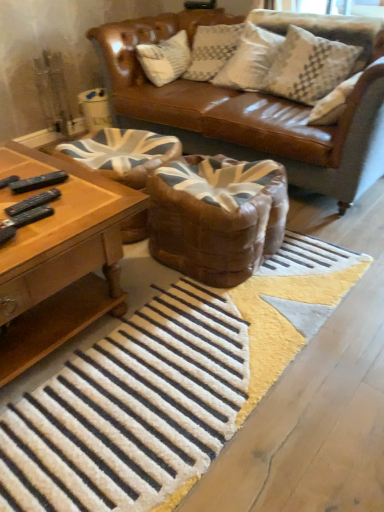
What is the approximate width of brown leather swivel chair at center, which ranks as the 1th swivel chair in right-to-left order?

brown leather swivel chair at center, which ranks as the 1th swivel chair in right-to-left order, is 20.71 inches wide.

Describe the element at coordinates (166, 387) in the screenshot. The image size is (384, 512). I see `white textured rug at center` at that location.

Identify the location of brown woven swivel chair at center, which is the first swivel chair from left to right. (122, 153).

Describe the element at coordinates (122, 153) in the screenshot. I see `brown woven swivel chair at center, which is the first swivel chair from left to right` at that location.

What do you see at coordinates (309, 66) in the screenshot? I see `white textured pillow at upper right` at bounding box center [309, 66].

What are the coordinates of `woodenobject at left` in the screenshot? It's located at (60, 261).

Could you tell me if white textured rug at center is turned towards brown woven swivel chair at center, which is the first swivel chair from left to right?

No, white textured rug at center is not oriented towards brown woven swivel chair at center, which is the first swivel chair from left to right.

Is brown woven swivel chair at center, positioned as the second swivel chair in right-to-left order, a part of white textured rug at center?

No, brown woven swivel chair at center, positioned as the second swivel chair in right-to-left order, is not surrounded by white textured rug at center.

Between white textured rug at center and brown woven swivel chair at center, which is the first swivel chair from left to right, which one appears on the left side from the viewer's perspective?

Positioned to the left is brown woven swivel chair at center, which is the first swivel chair from left to right.

From a real-world perspective, between white textured rug at center and brown woven swivel chair at center, which is the first swivel chair from left to right, who is vertically lower?

white textured rug at center, from a real-world perspective.

From a real-world perspective, is brown woven swivel chair at center, which is the first swivel chair from left to right, on woodenobject at left?

No, from a real-world perspective, brown woven swivel chair at center, which is the first swivel chair from left to right, is not above woodenobject at left.

From their relative heights in the image, would you say brown woven swivel chair at center, positioned as the second swivel chair in right-to-left order, is taller or shorter than woodenobject at left?

In the image, brown woven swivel chair at center, positioned as the second swivel chair in right-to-left order, appears to be shorter than woodenobject at left.

Which is behind, brown woven swivel chair at center, positioned as the second swivel chair in right-to-left order, or woodenobject at left?

brown woven swivel chair at center, positioned as the second swivel chair in right-to-left order, is more distant.

Looking at their sizes, would you say brown woven swivel chair at center, positioned as the second swivel chair in right-to-left order, is wider or thinner than woodenobject at left?

Clearly, brown woven swivel chair at center, positioned as the second swivel chair in right-to-left order, has less width compared to woodenobject at left.

How far apart are woodenobject at left and brown leather swivel chair at center, the second swivel chair in the left-to-right sequence?

16.30 inches.

Which is more to the right, woodenobject at left or brown leather swivel chair at center, which ranks as the 1th swivel chair in right-to-left order?

brown leather swivel chair at center, which ranks as the 1th swivel chair in right-to-left order, is more to the right.

Looking at this image, which point is more forward, (30, 275) or (284, 220)?

Positioned in front is point (30, 275).

Considering the relative positions of woodenobject at left and brown leather swivel chair at center, the second swivel chair in the left-to-right sequence, in the image provided, is woodenobject at left behind brown leather swivel chair at center, the second swivel chair in the left-to-right sequence,?

No, it is in front of brown leather swivel chair at center, the second swivel chair in the left-to-right sequence.

Is woodenobject at left oriented towards brown woven swivel chair at center, which is the first swivel chair from left to right?

No, woodenobject at left is not aimed at brown woven swivel chair at center, which is the first swivel chair from left to right.

What's the angular difference between woodenobject at left and brown woven swivel chair at center, positioned as the second swivel chair in right-to-left order,'s facing directions?

80 degrees.

You are a GUI agent. You are given a task and a screenshot of the screen. Output one action in this format:
    pyautogui.click(x=<x>, y=<y>)
    Task: Click on the swivel chair that is the 2nd object located above the woodenobject at left (from the image's perspective)
    
    Given the screenshot: What is the action you would take?
    pyautogui.click(x=122, y=153)

Is the position of brown leather swivel chair at center, the second swivel chair in the left-to-right sequence, more distant than that of white textured pillow at upper right?

No, it is not.

Does brown leather swivel chair at center, the second swivel chair in the left-to-right sequence, have a lesser width compared to white textured pillow at upper right?

No.

Does brown leather swivel chair at center, the second swivel chair in the left-to-right sequence, have a smaller size compared to white textured pillow at upper right?

No.

Locate an element on the screen. swivel chair that is the 1st one below the white textured pillow at upper right (from a real-world perspective) is located at coordinates (216, 216).

Is white textured pillow at upper right inside woodenobject at left?

That's incorrect, white textured pillow at upper right is not inside woodenobject at left.

From a real-world perspective, is woodenobject at left physically above white textured pillow at upper right?

No, from a real-world perspective, woodenobject at left is not above white textured pillow at upper right.

From their relative heights in the image, would you say woodenobject at left is taller or shorter than white textured pillow at upper right?

Clearly, woodenobject at left is shorter compared to white textured pillow at upper right.

Is woodenobject at left bigger than white textured pillow at upper right?

Correct, woodenobject at left is larger in size than white textured pillow at upper right.

Considering the sizes of white textured pillow at upper right and brown leather swivel chair at center, the second swivel chair in the left-to-right sequence, in the image, is white textured pillow at upper right bigger or smaller than brown leather swivel chair at center, the second swivel chair in the left-to-right sequence,?

Considering their sizes, white textured pillow at upper right takes up less space than brown leather swivel chair at center, the second swivel chair in the left-to-right sequence.

Looking at their sizes, would you say white textured pillow at upper right is wider or thinner than brown leather swivel chair at center, the second swivel chair in the left-to-right sequence?

Clearly, white textured pillow at upper right has less width compared to brown leather swivel chair at center, the second swivel chair in the left-to-right sequence.

Find the location of `swivel chair on the left of white textured rug at center`. swivel chair on the left of white textured rug at center is located at coordinates (122, 153).

Which swivel chair is the 2nd one when counting from the back of the woodenobject at left? Please provide its 2D coordinates.

[(122, 153)]

Which object lies further to the anchor point brown leather swivel chair at center, the second swivel chair in the left-to-right sequence, white textured rug at center or brown woven swivel chair at center, which is the first swivel chair from left to right?

Based on the image, white textured rug at center appears to be further to brown leather swivel chair at center, the second swivel chair in the left-to-right sequence.

Looking at the image, which one is located further to woodenobject at left, white textured rug at center or brown woven swivel chair at center, which is the first swivel chair from left to right?

brown woven swivel chair at center, which is the first swivel chair from left to right, is further to woodenobject at left.

When comparing their distances from white textured rug at center, does white textured pillow at upper right or woodenobject at left seem further?

white textured pillow at upper right is positioned further to the anchor white textured rug at center.

When comparing their distances from brown woven swivel chair at center, positioned as the second swivel chair in right-to-left order, does white textured pillow at upper right or white textured rug at center seem closer?

The object closer to brown woven swivel chair at center, positioned as the second swivel chair in right-to-left order, is white textured rug at center.

Considering their positions, is woodenobject at left positioned closer to brown leather swivel chair at center, the second swivel chair in the left-to-right sequence, than white textured pillow at upper right?

woodenobject at left is positioned closer to the anchor brown leather swivel chair at center, the second swivel chair in the left-to-right sequence.

From the image, which object appears to be farther from white textured rug at center, white textured pillow at upper right or brown leather swivel chair at center, the second swivel chair in the left-to-right sequence?

The object further to white textured rug at center is white textured pillow at upper right.

Considering their positions, is brown woven swivel chair at center, which is the first swivel chair from left to right, positioned closer to brown leather swivel chair at center, the second swivel chair in the left-to-right sequence, than woodenobject at left?

brown woven swivel chair at center, which is the first swivel chair from left to right, is closer to brown leather swivel chair at center, the second swivel chair in the left-to-right sequence.

Considering their positions, is brown leather swivel chair at center, the second swivel chair in the left-to-right sequence, positioned closer to woodenobject at left than white textured rug at center?

white textured rug at center is closer to woodenobject at left.

The image size is (384, 512). I want to click on doormat between woodenobject at left and brown leather swivel chair at center, which ranks as the 1th swivel chair in right-to-left order, from left to right, so click(166, 387).

Find the location of a particular element. The height and width of the screenshot is (512, 384). coffee table that lies between white textured pillow at upper right and white textured rug at center from top to bottom is located at coordinates (60, 261).

Locate an element on the screen. The width and height of the screenshot is (384, 512). coffee table located between white textured rug at center and brown woven swivel chair at center, positioned as the second swivel chair in right-to-left order, in the depth direction is located at coordinates (60, 261).

In order to click on swivel chair between brown woven swivel chair at center, positioned as the second swivel chair in right-to-left order, and white textured pillow at upper right from left to right in this screenshot , I will do `click(216, 216)`.